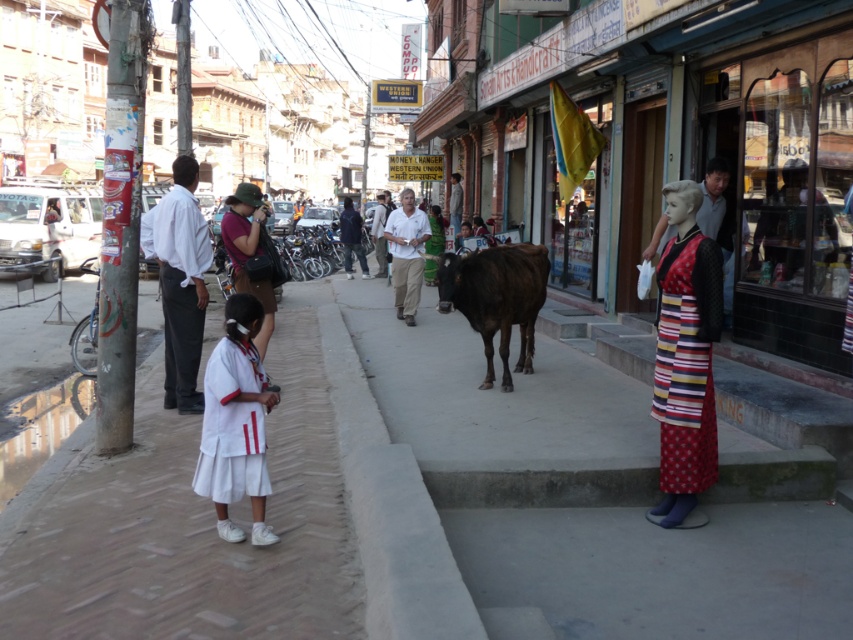
From the picture: You are a delivery person trying to place a package on the white concrete pavement at lower left. However, there is a striped fabric dress at right in the way. Can you place the package on the pavement without moving the dress?

The white concrete pavement at lower left is positioned under the striped fabric dress at right, so the dress is hanging over the pavement. Therefore, you cannot place the package there without moving the dress.

You are a delivery person trying to navigate the sidewalk in the image. There is a striped fabric dress at right and a white concrete pavement at lower left. Which object is closer to you as you stand on the sidewalk?

The white concrete pavement at lower left is closer to you because the striped fabric dress at right is behind it.